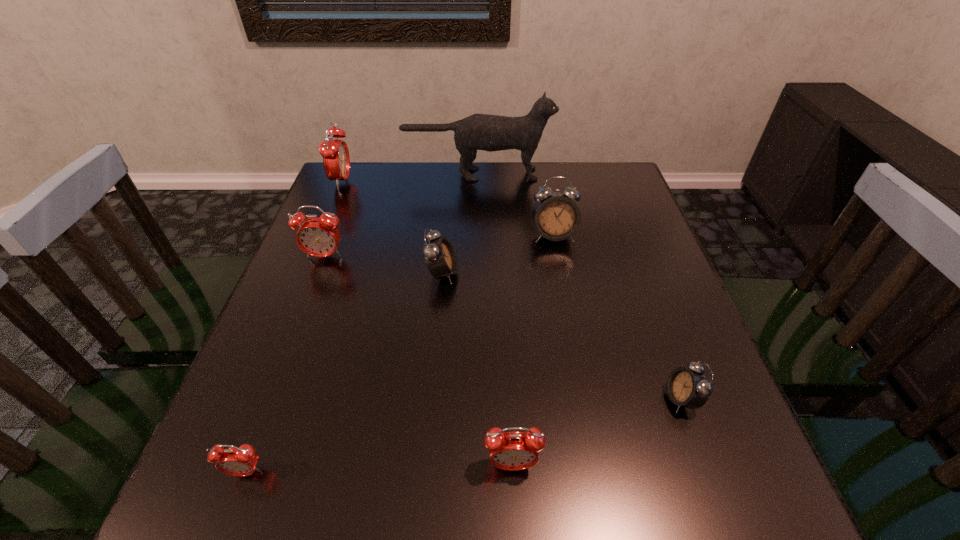
Locate an element on the screen. The width and height of the screenshot is (960, 540). vacant region at the right edge of the desktop is located at coordinates (704, 453).

Locate an element on the screen. This screenshot has width=960, height=540. free space at the far right corner of the desktop is located at coordinates (603, 199).

You are a GUI agent. You are given a task and a screenshot of the screen. Output one action in this format:
    pyautogui.click(x=<x>, y=<y>)
    Task: Click on the free space between the tallest alarm clock and the rightmost alarm clock
    The height and width of the screenshot is (540, 960).
    Given the screenshot: What is the action you would take?
    pyautogui.click(x=512, y=291)

Identify the location of free area in between the smallest red alarm clock and the farthest alarm clock. This screenshot has height=540, width=960. (295, 327).

You are a GUI agent. You are given a task and a screenshot of the screen. Output one action in this format:
    pyautogui.click(x=<x>, y=<y>)
    Task: Click on the vacant region between the third alarm clock from right to left and the sixth alarm clock from left to right
    The image size is (960, 540).
    Given the screenshot: What is the action you would take?
    pyautogui.click(x=533, y=350)

The image size is (960, 540). In order to click on free spot between the farthest alarm clock and the second alarm clock from right to left in this screenshot , I will do `click(447, 209)`.

Where is `free space between the second farthest alarm clock and the tallest object`? This screenshot has height=540, width=960. free space between the second farthest alarm clock and the tallest object is located at coordinates (516, 205).

Image resolution: width=960 pixels, height=540 pixels. I want to click on free space that is in between the second biggest white alarm clock and the black cat, so click(460, 224).

This screenshot has width=960, height=540. I want to click on unoccupied position between the second farthest red alarm clock and the smallest red alarm clock, so click(x=285, y=364).

You are a GUI agent. You are given a task and a screenshot of the screen. Output one action in this format:
    pyautogui.click(x=<x>, y=<y>)
    Task: Click on the free space between the second smallest white alarm clock and the second biggest red alarm clock
    Image resolution: width=960 pixels, height=540 pixels.
    Given the screenshot: What is the action you would take?
    pyautogui.click(x=383, y=265)